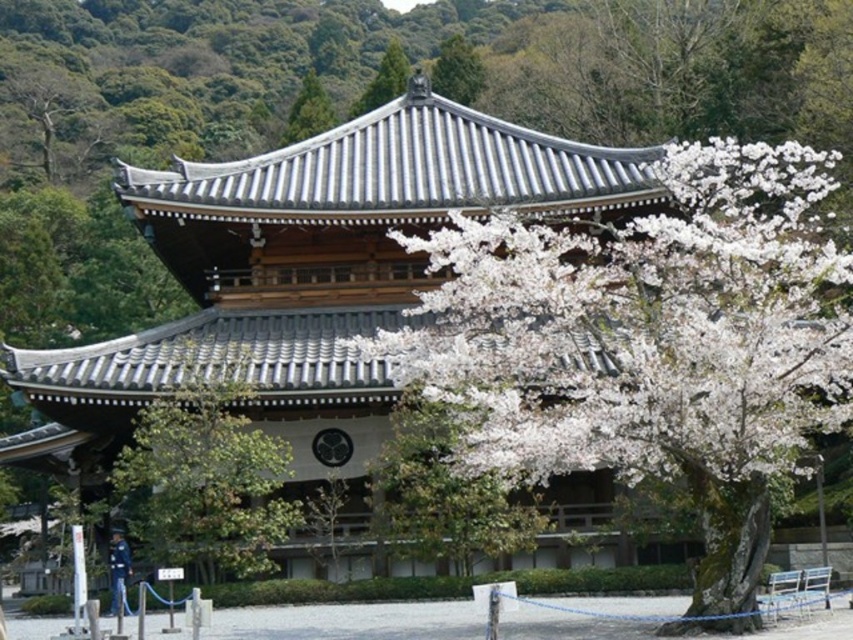
Question: Is green leafy tree at center to the right of white matte tree at center from the viewer's perspective?

Choices:
 (A) yes
 (B) no

Answer: (B)

Question: Can you confirm if green leafy tree at center is thinner than green textured pine tree at upper center?

Choices:
 (A) no
 (B) yes

Answer: (B)

Question: Which of these objects is positioned closest to the white blossoming tree at upper center?

Choices:
 (A) white matte tree at center
 (B) green textured pine tree at upper center
 (C) white matte tree at upper center
 (D) shiny gray pagoda at center

Answer: (B)

Question: Which is farther from the green textured pine tree at upper center?

Choices:
 (A) white fluffy blossoms at right
 (B) white matte tree at center

Answer: (A)

Question: Does green textured pine tree at upper center have a lesser width compared to white blossoming tree at upper center?

Choices:
 (A) yes
 (B) no

Answer: (B)

Question: Based on their relative distances, which object is nearer to the white matte tree at center?

Choices:
 (A) white matte tree at upper center
 (B) green textured pine tree at upper center
 (C) shiny gray pagoda at center
 (D) white fluffy blossoms at right

Answer: (C)